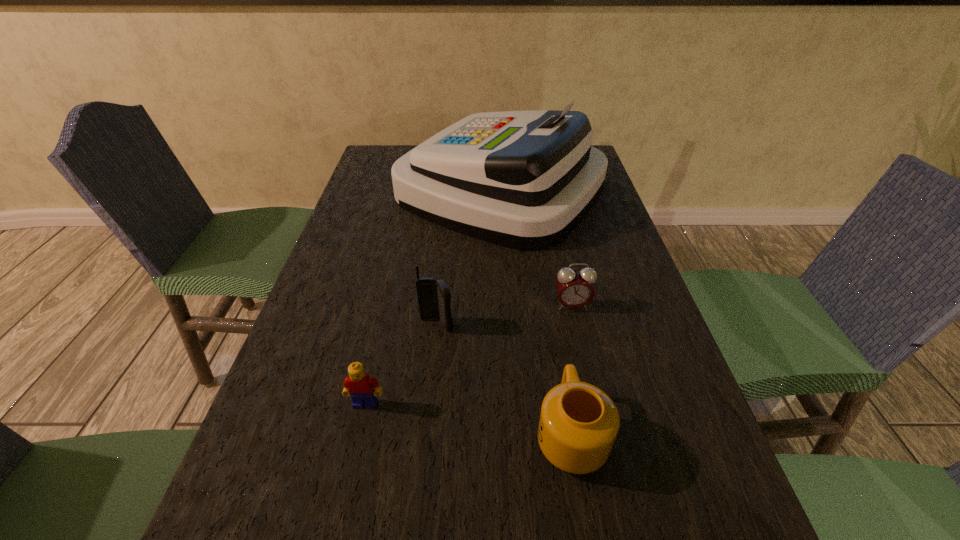
This screenshot has width=960, height=540. In order to click on the farthest object in this screenshot , I will do `click(524, 180)`.

This screenshot has width=960, height=540. I want to click on the tallest object, so click(524, 180).

The width and height of the screenshot is (960, 540). What are the coordinates of `the third nearest object` in the screenshot? It's located at (434, 298).

You are a GUI agent. You are given a task and a screenshot of the screen. Output one action in this format:
    pyautogui.click(x=<x>, y=<y>)
    Task: Click on the second tallest object
    
    Given the screenshot: What is the action you would take?
    pyautogui.click(x=434, y=298)

Image resolution: width=960 pixels, height=540 pixels. Identify the location of alarm clock. (575, 289).

Locate an element on the screen. The height and width of the screenshot is (540, 960). mug is located at coordinates (579, 422).

You are a GUI agent. You are given a task and a screenshot of the screen. Output one action in this format:
    pyautogui.click(x=<x>, y=<y>)
    Task: Click on the Lego
    This screenshot has height=540, width=960.
    Given the screenshot: What is the action you would take?
    pyautogui.click(x=359, y=385)

Find the location of a particular element. This screenshot has height=540, width=960. free spot located on the front of the farthest object is located at coordinates (510, 326).

Identify the location of vacant space located on the keyboard of the cellular telephone. (432, 372).

Locate an element on the screen. The image size is (960, 540). blank space located 0.400m on the clock face of the alarm clock is located at coordinates (615, 500).